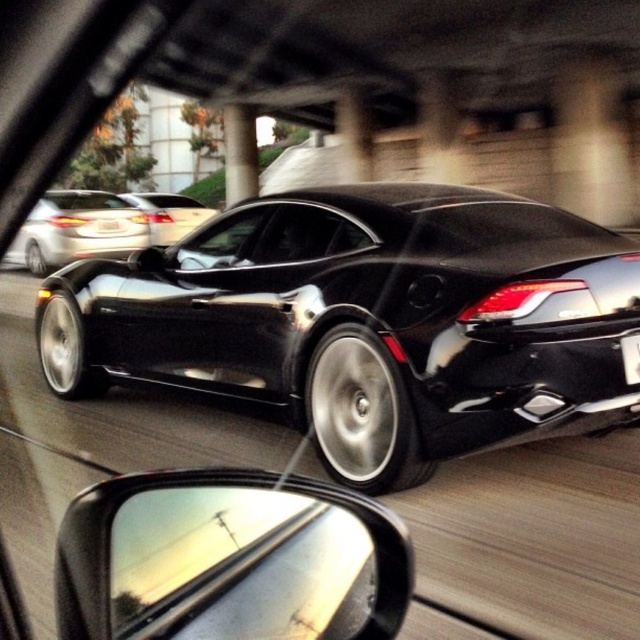
Looking at this image, is black plastic side mirror at lower left positioned at the back of satin silver car at upper left?

No, it is in front of satin silver car at upper left.

Between point (177, 492) and point (13, 260), which one is positioned behind?

The point (13, 260) is more distant.

Is point (160, 632) positioned in front of point (29, 250)?

Yes, point (160, 632) is in front of point (29, 250).

Locate an element on the screen. This screenshot has width=640, height=640. black plastic side mirror at lower left is located at coordinates (228, 560).

Between point (250, 112) and point (630, 337), which one is positioned in front?

Point (630, 337)

Does concrete/rough pillar at center have a lesser width compared to black plastic license plate at rear?

No.

Does point (240, 134) come farther from viewer compared to point (628, 336)?

That is True.

Where is `concrete/rough pillar at center`? Image resolution: width=640 pixels, height=640 pixels. concrete/rough pillar at center is located at coordinates (240, 152).

Is shiny black sports car at center to the right of concrete/rough pillar at center from the viewer's perspective?

Indeed, shiny black sports car at center is positioned on the right side of concrete/rough pillar at center.

Does shiny black sports car at center have a lesser height compared to concrete/rough pillar at center?

Yes, shiny black sports car at center is shorter than concrete/rough pillar at center.

Locate an element on the screen. shiny black sports car at center is located at coordinates (368, 321).

Where is `shiny black sports car at center`? Image resolution: width=640 pixels, height=640 pixels. shiny black sports car at center is located at coordinates (368, 321).